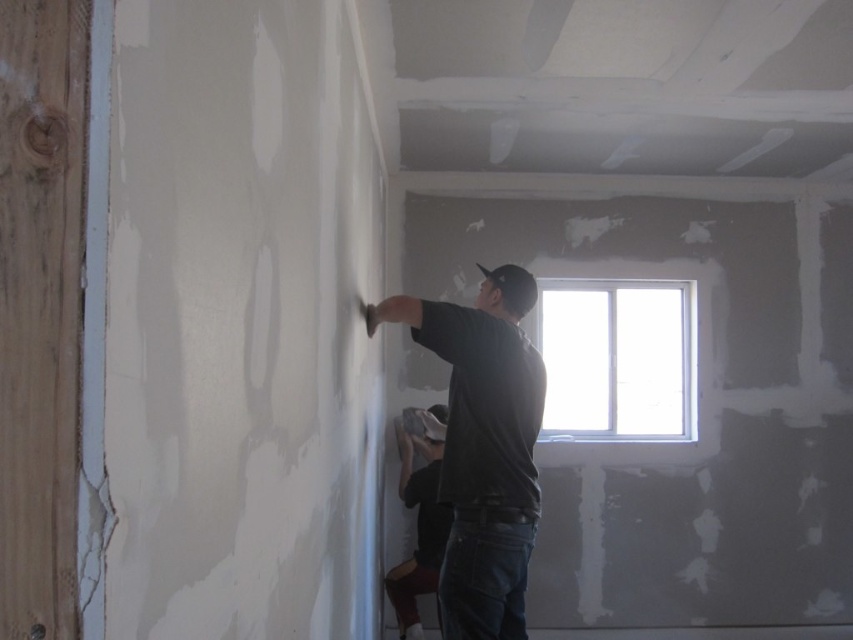
Question: Which object is positioned closest to the dark gray matte shirt at center?

Choices:
 (A) clear glass window at upper center
 (B) dark gray shirt at center

Answer: (B)

Question: Can you confirm if dark gray matte shirt at center is positioned to the right of dark gray shirt at center?

Choices:
 (A) no
 (B) yes

Answer: (B)

Question: Can you confirm if dark gray matte shirt at center is wider than dark gray shirt at center?

Choices:
 (A) yes
 (B) no

Answer: (A)

Question: Is clear glass window at upper center below dark gray shirt at center?

Choices:
 (A) yes
 (B) no

Answer: (B)

Question: Among these objects, which one is nearest to the camera?

Choices:
 (A) clear glass window at upper center
 (B) dark gray matte shirt at center

Answer: (B)

Question: Which object is positioned closest to the clear glass window at upper center?

Choices:
 (A) dark gray shirt at center
 (B) dark gray matte shirt at center

Answer: (A)